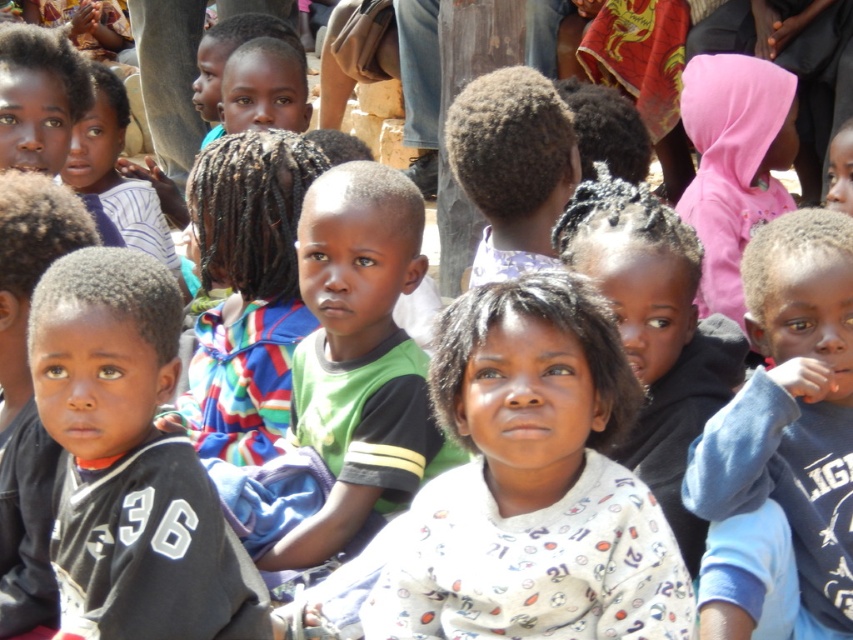
Which is more to the right, black jersey at left or blue fleece jacket at right?

blue fleece jacket at right

The width and height of the screenshot is (853, 640). I want to click on black jersey at left, so click(129, 461).

Locate an element on the screen. The height and width of the screenshot is (640, 853). black jersey at left is located at coordinates (129, 461).

Is point (177, 436) positioned after point (413, 476)?

That is False.

Which of these two, black jersey at left or green jersey at center, stands taller?

Standing taller between the two is green jersey at center.

Is point (103, 408) positioned after point (334, 348)?

No, (103, 408) is in front of (334, 348).

Where is `black jersey at left`? The height and width of the screenshot is (640, 853). black jersey at left is located at coordinates (129, 461).

Based on the photo, which of these two, blue fleece jacket at right or green jersey at center, stands shorter?

blue fleece jacket at right is shorter.

Can you confirm if blue fleece jacket at right is positioned below green jersey at center?

Indeed, blue fleece jacket at right is positioned under green jersey at center.

Between point (842, 564) and point (281, 544), which one is positioned behind?

Point (281, 544)

This screenshot has height=640, width=853. In order to click on blue fleece jacket at right in this screenshot , I will do `click(782, 445)`.